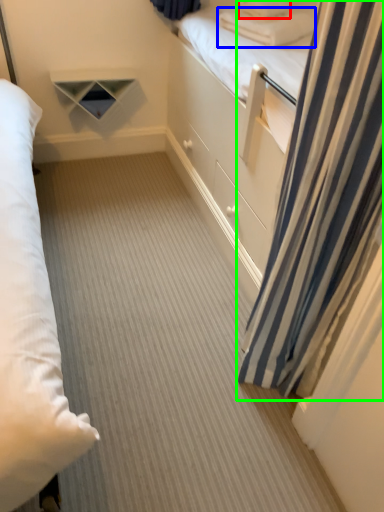
Question: Which object is positioned farthest from pillow (highlighted by a red box)? Select from pillow (highlighted by a blue box) and curtain (highlighted by a green box).

Choices:
 (A) pillow
 (B) curtain

Answer: (B)